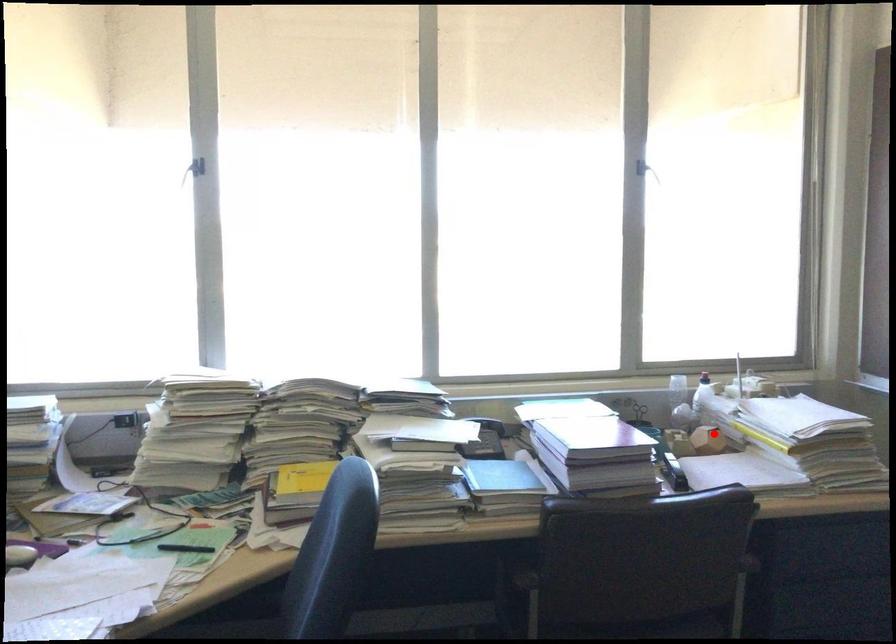
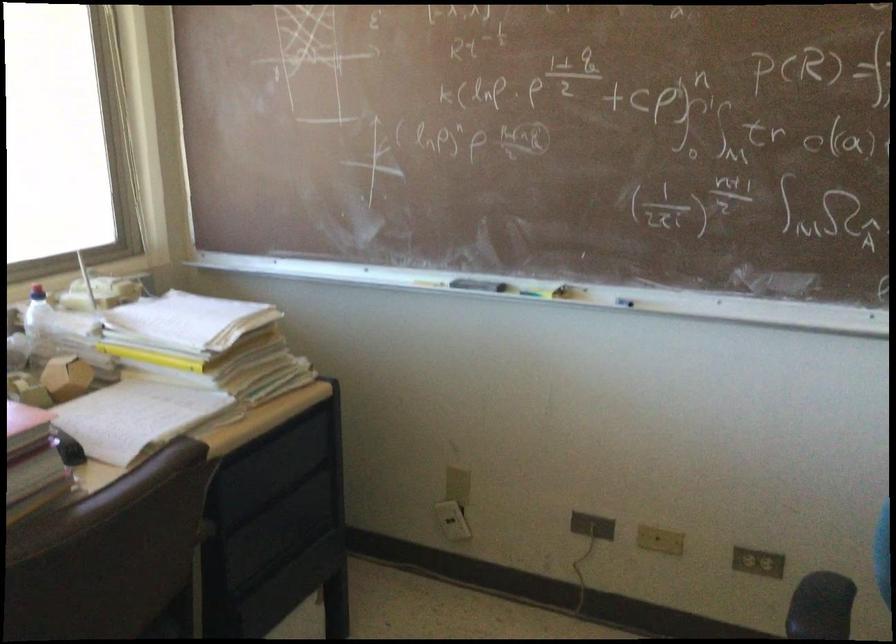
Find the pixel in the second image that matches the highlighted location in the first image.

(65, 377)